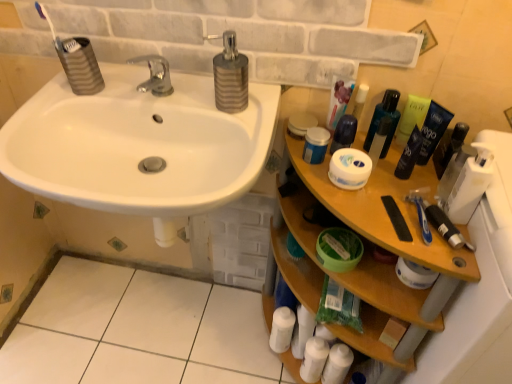
This screenshot has width=512, height=384. In order to click on free space to the back side of blue plastic toothbrush at right, acting as the second toothbrush starting from the left in this screenshot , I will do `click(409, 180)`.